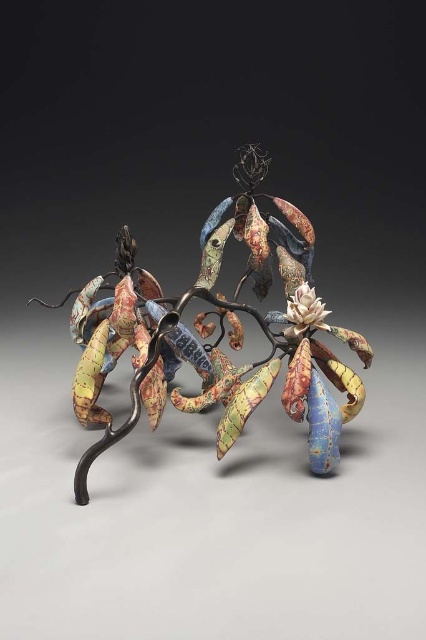
Question: Which point is closer to the camera?

Choices:
 (A) white matte flower at center
 (B) textured ceramic leaves at center

Answer: (B)

Question: Can you confirm if textured ceramic leaves at center is positioned below white matte flower at center?

Choices:
 (A) no
 (B) yes

Answer: (B)

Question: Among these objects, which one is nearest to the camera?

Choices:
 (A) white matte flower at center
 (B) textured ceramic leaves at center

Answer: (B)

Question: Where is textured ceramic leaves at center located in relation to white matte flower at center in the image?

Choices:
 (A) right
 (B) left

Answer: (B)

Question: Is textured ceramic leaves at center smaller than white matte flower at center?

Choices:
 (A) no
 (B) yes

Answer: (A)

Question: Which point appears farthest from the camera in this image?

Choices:
 (A) (313, 410)
 (B) (299, 300)

Answer: (B)